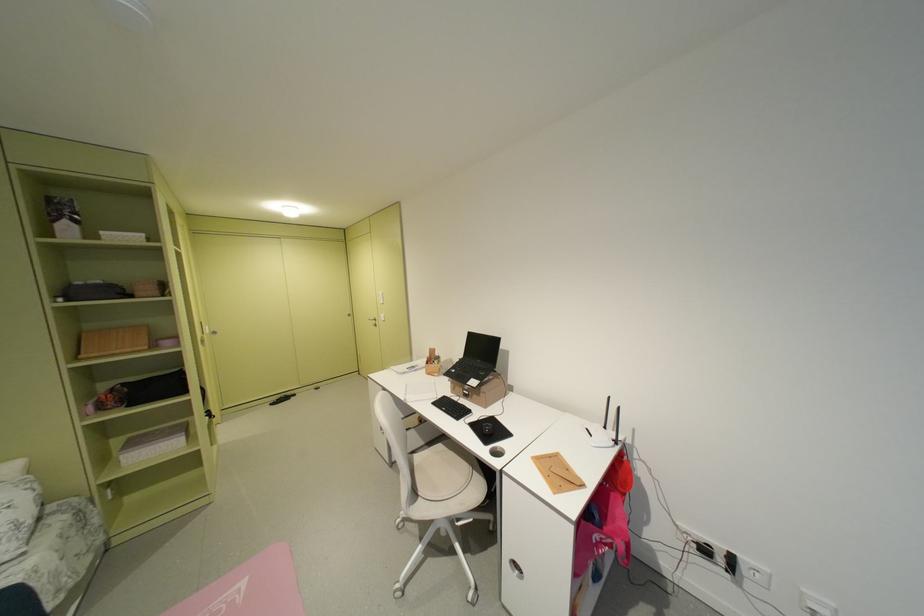
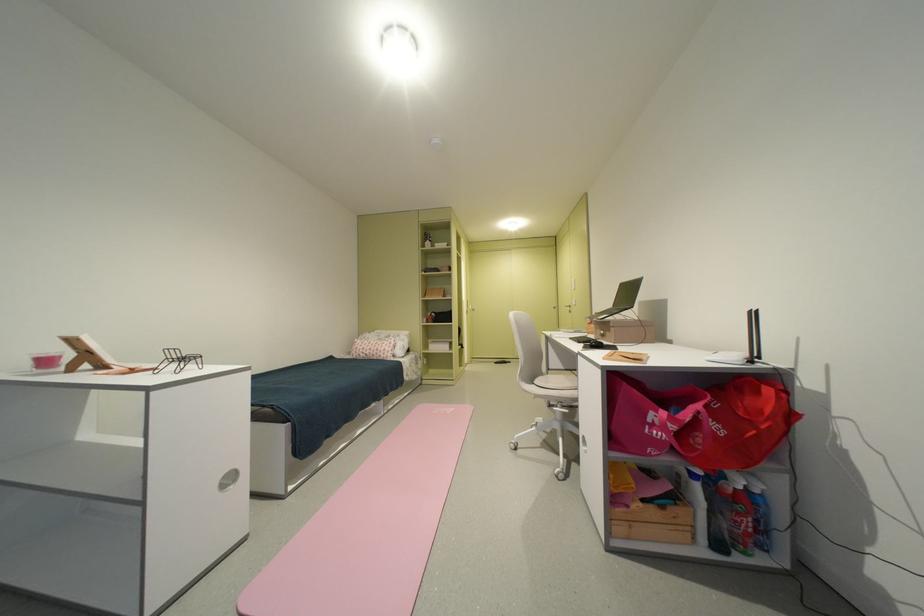
In the second image, find the point that corresponds to point 612,553 in the first image.

(665, 432)